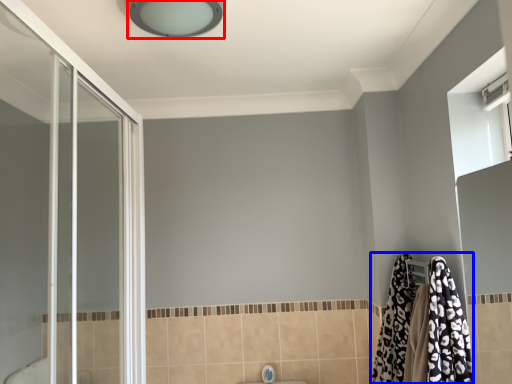
Question: Which object is closer to the camera taking this photo, light fixture (highlighted by a red box) or bathrobe (highlighted by a blue box)?

Choices:
 (A) light fixture
 (B) bathrobe

Answer: (A)